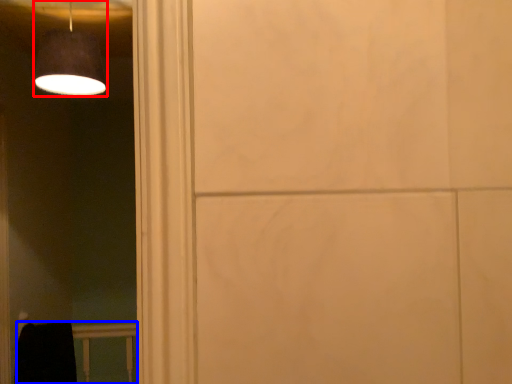
Question: Which object is closer to the camera taking this photo, lamp (highlighted by a red box) or balustrade (highlighted by a blue box)?

Choices:
 (A) lamp
 (B) balustrade

Answer: (A)